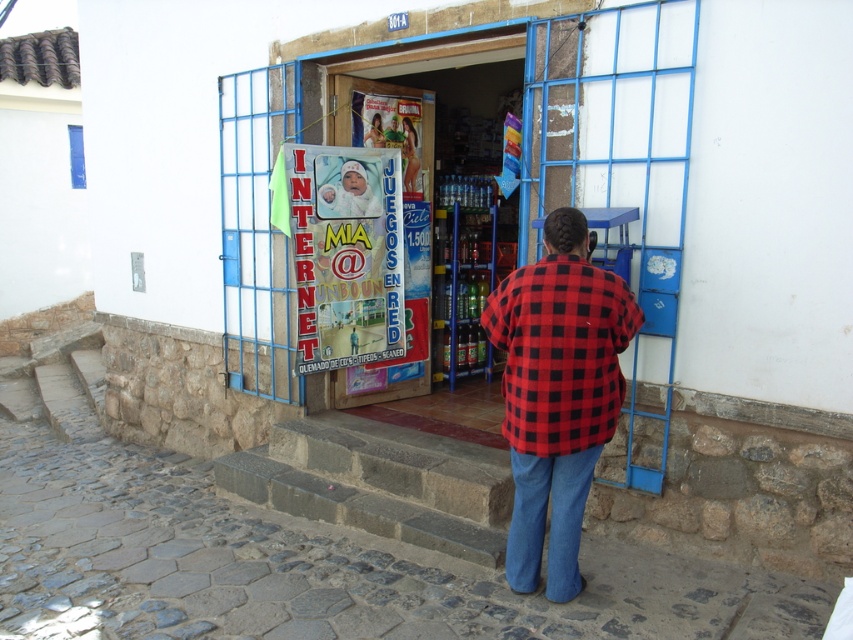
You are a customer entering the shop and see a person wearing a red checkered shirt at center and blue denim jeans at lower center. Which clothing item is nearer to you as you approach the entrance?

The red checkered shirt at center is closer to the viewer than blue denim jeans at lower center, so the red checkered shirt at center is nearer to you as you approach the entrance.

You are standing at the entrance of the shop and want to reach the point labeled point (451, 333). Which direction should you move relative to point (558, 467)?

You should move behind point (558, 467) to reach point (451, 333) since it is located behind it.